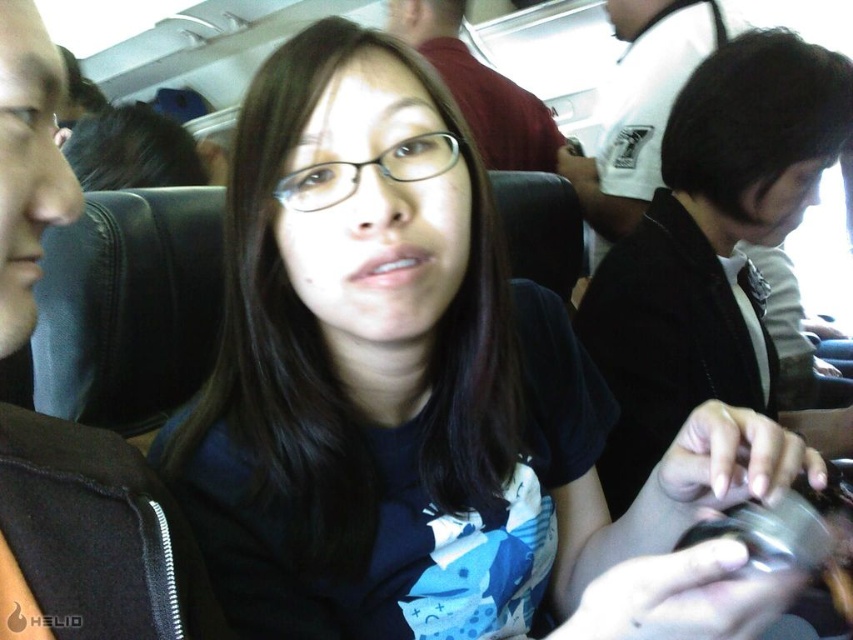
Question: Can you confirm if maroon shirt at upper center is positioned to the left of metallic silver cup at lower right?

Choices:
 (A) yes
 (B) no

Answer: (A)

Question: Does maroon shirt at upper center appear on the right side of metallic silver cup at lower right?

Choices:
 (A) no
 (B) yes

Answer: (A)

Question: Does black fabric jacket at left appear under maroon shirt at upper center?

Choices:
 (A) yes
 (B) no

Answer: (A)

Question: Which of the following is the farthest from the observer?

Choices:
 (A) (560, 138)
 (B) (22, 305)
 (C) (793, 541)
 (D) (795, 342)

Answer: (A)

Question: Which point is farther to the camera?

Choices:
 (A) black matte jacket at right
 (B) black fabric jacket at left
 (C) maroon shirt at upper center
 (D) metallic silver cup at lower right

Answer: (C)

Question: Estimate the real-world distances between objects in this image. Which object is farther from the black fabric jacket at left?

Choices:
 (A) metallic silver cup at lower right
 (B) maroon shirt at upper center

Answer: (B)